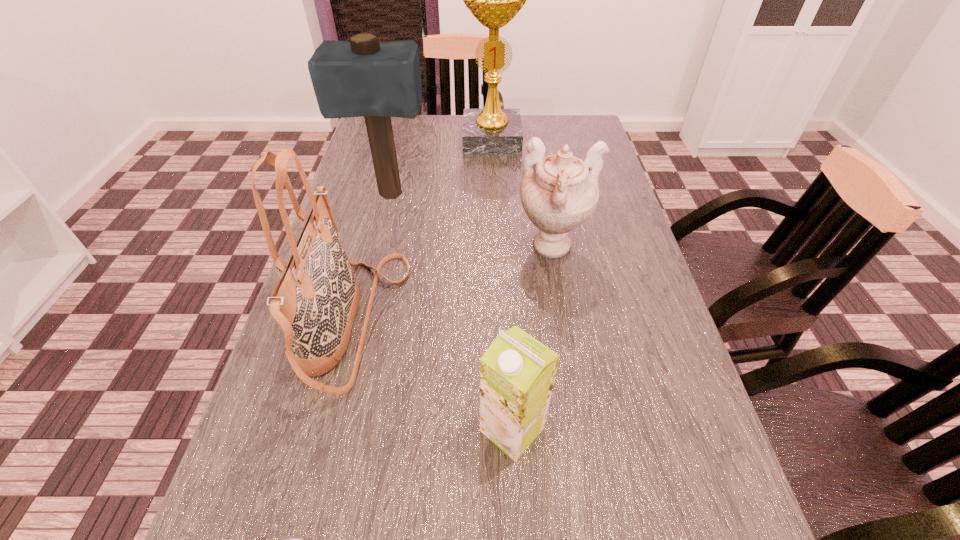
Where is `object positioned at the far edge`? The width and height of the screenshot is (960, 540). object positioned at the far edge is located at coordinates (494, 0).

This screenshot has width=960, height=540. I want to click on mallet that is at the left edge, so click(362, 77).

Locate an element on the screen. This screenshot has height=540, width=960. handbag that is positioned at the left edge is located at coordinates (315, 302).

The image size is (960, 540). Identify the location of object located at the right edge. (559, 192).

Find the location of a particular element. vacant space at the left edge of the desktop is located at coordinates (367, 157).

Find the location of a particular element. This screenshot has width=960, height=540. free spot at the right edge of the desktop is located at coordinates (636, 266).

I want to click on vacant region at the far left corner, so click(409, 135).

This screenshot has width=960, height=540. I want to click on vacant space at the far right corner of the desktop, so click(x=544, y=119).

At what (x,y) coordinates should I click in order to perform the action: click on vacant area that lies between the fifth nearest object and the urn. Please return your answer as a coordinate pair (x, y). This screenshot has width=960, height=540. Looking at the image, I should click on (471, 222).

I want to click on unoccupied area between the second farthest object and the urn, so click(x=471, y=222).